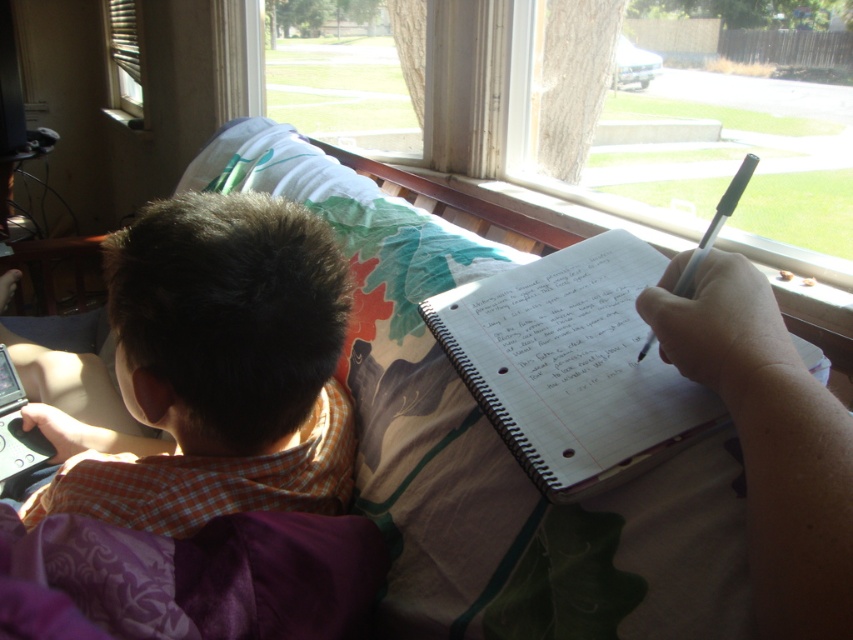
Question: Is the position of brown checkered shirt at left less distant than that of black plastic pen at upper right?

Choices:
 (A) yes
 (B) no

Answer: (A)

Question: Is transparent glass window at upper center positioned in front of black plastic pen at upper right?

Choices:
 (A) no
 (B) yes

Answer: (A)

Question: Which point appears farthest from the camera in this image?

Choices:
 (A) (123, 28)
 (B) (650, 401)

Answer: (A)

Question: Estimate the real-world distances between objects in this image. Which object is farther from the brown checkered shirt at left?

Choices:
 (A) transparent glass window at upper center
 (B) white paper notebook at center

Answer: (A)

Question: Which point is closer to the camera?

Choices:
 (A) (534, 268)
 (B) (107, 45)

Answer: (A)

Question: Can you confirm if white paper notebook at center is bigger than transparent glass window at upper center?

Choices:
 (A) no
 (B) yes

Answer: (A)